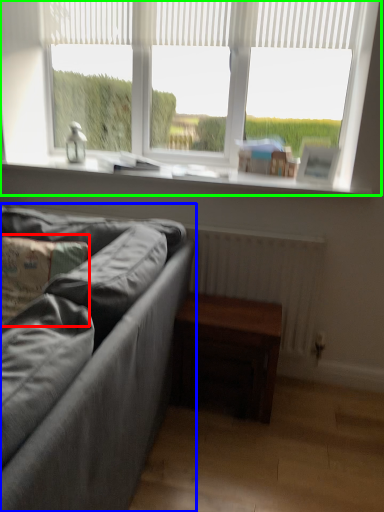
Question: Which object is the farthest from pillow (highlighted by a red box)? Choose among these: studio couch (highlighted by a blue box) or window (highlighted by a green box).

Choices:
 (A) studio couch
 (B) window

Answer: (B)